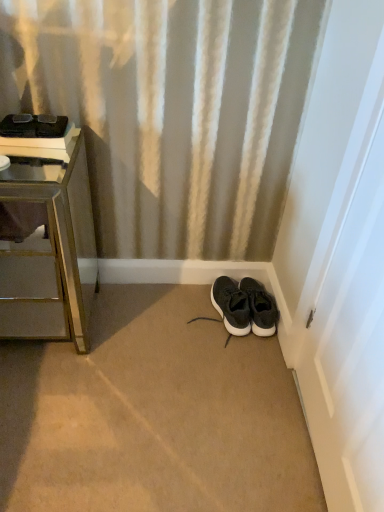
Locate an element on the screen. vacant space in front of black suede sneakers at lower right, the second footwear when ordered from left to right is located at coordinates (253, 354).